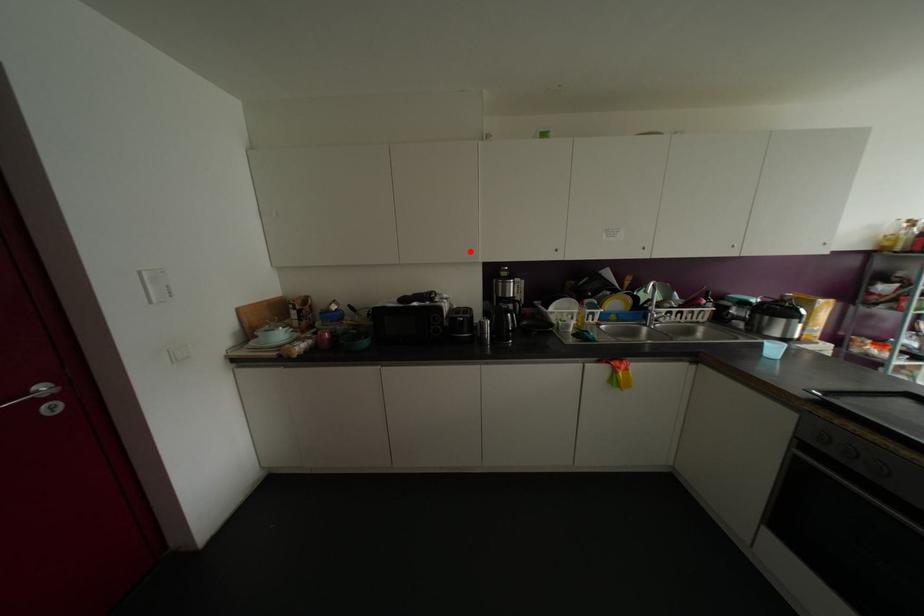
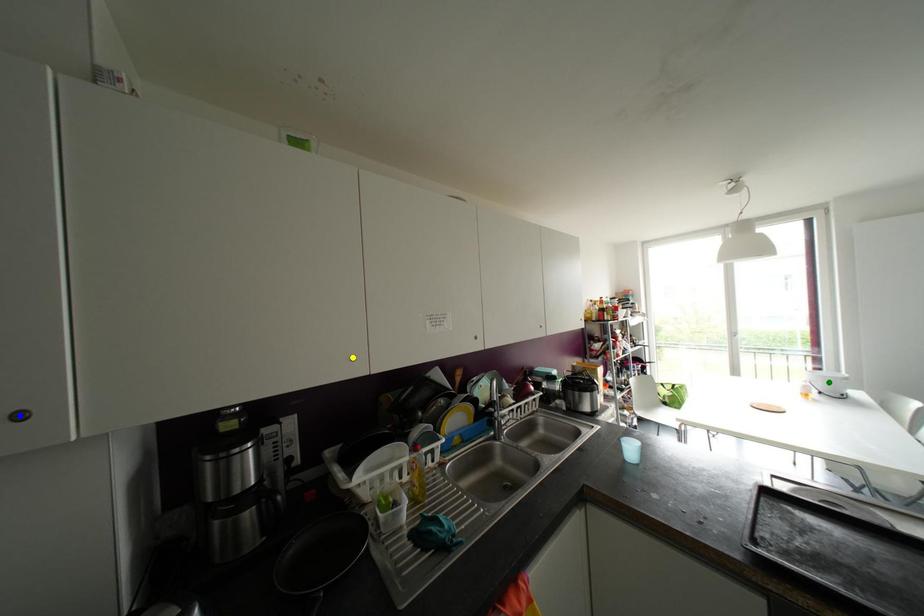
Question: I am providing you with two images of the same scene from different viewpoints. A red point is marked on the first image. You are given multiple points on the second image. Which mark in image 2 goes with the point in image 1?

Choices:
 (A) yellow point
 (B) blue point
 (C) green point

Answer: (B)